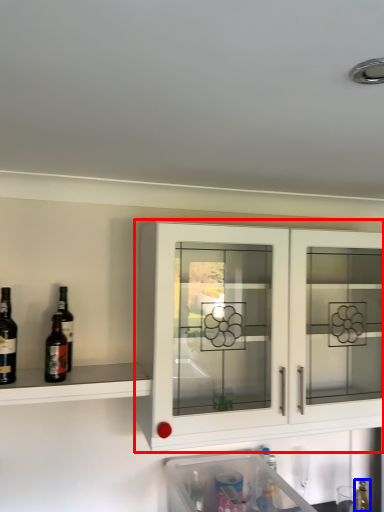
Question: Which object is further to the camera taking this photo, cabinetry (highlighted by a red box) or bottle (highlighted by a blue box)?

Choices:
 (A) cabinetry
 (B) bottle

Answer: (B)